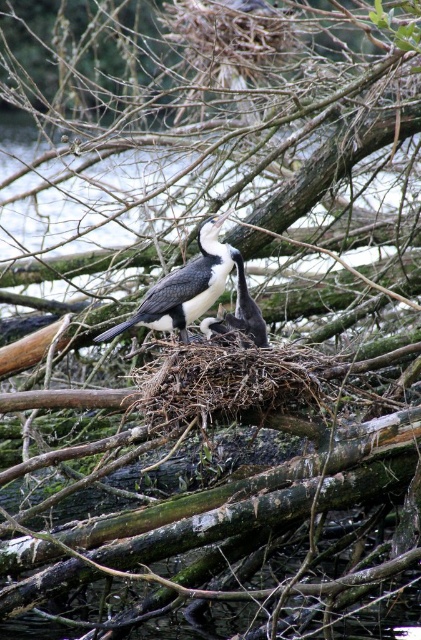
Question: Among these points, which one is nearest to the camera?

Choices:
 (A) (194, 298)
 (B) (229, 330)

Answer: (A)

Question: Is white-feathered bird at center to the right of white downy feathers at center from the viewer's perspective?

Choices:
 (A) no
 (B) yes

Answer: (A)

Question: Among these points, which one is farthest from the camera?

Choices:
 (A) (253, 340)
 (B) (151, 298)

Answer: (B)

Question: Can you confirm if white-feathered bird at center is positioned below white downy feathers at center?

Choices:
 (A) yes
 (B) no

Answer: (B)

Question: Does white-feathered bird at center appear on the left side of white downy feathers at center?

Choices:
 (A) no
 (B) yes

Answer: (B)

Question: Which object appears closest to the camera in this image?

Choices:
 (A) white-feathered bird at center
 (B) white downy feathers at center

Answer: (A)